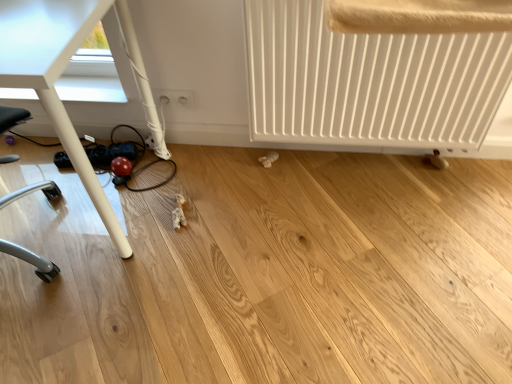
You are a GUI agent. You are given a task and a screenshot of the screen. Output one action in this format:
    pyautogui.click(x=<x>, y=<y>)
    Task: Click on the vacant region to the left of white matte radiator at lower right
    The width and height of the screenshot is (512, 384).
    Given the screenshot: What is the action you would take?
    [x=248, y=208]